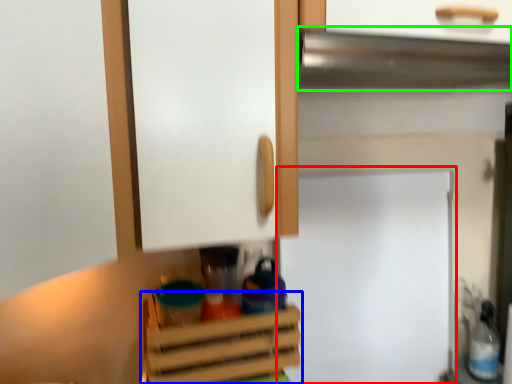
Question: Which is farther away from fridge (highlighted by a red box)? cabinetry (highlighted by a blue box) or exhaust hood (highlighted by a green box)?

Choices:
 (A) cabinetry
 (B) exhaust hood

Answer: (B)